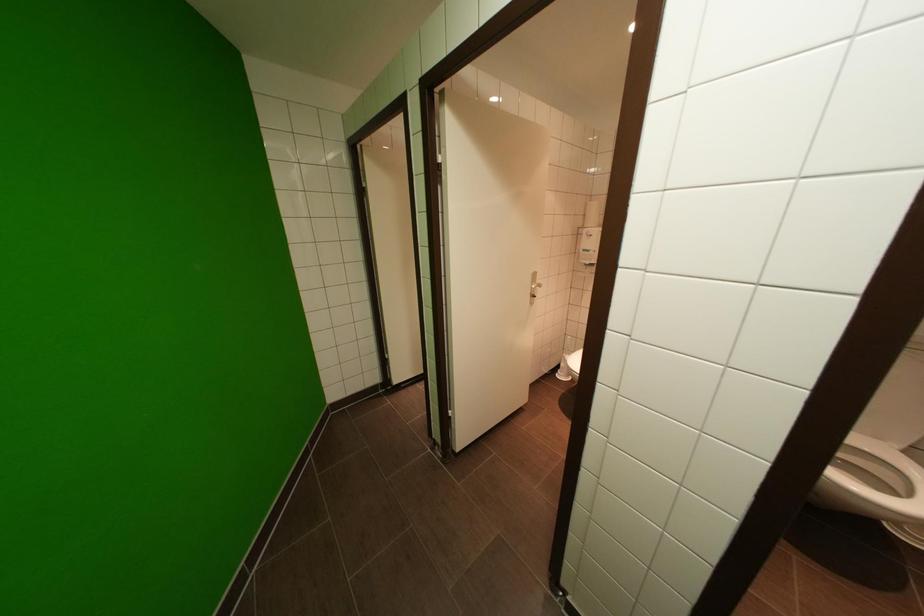
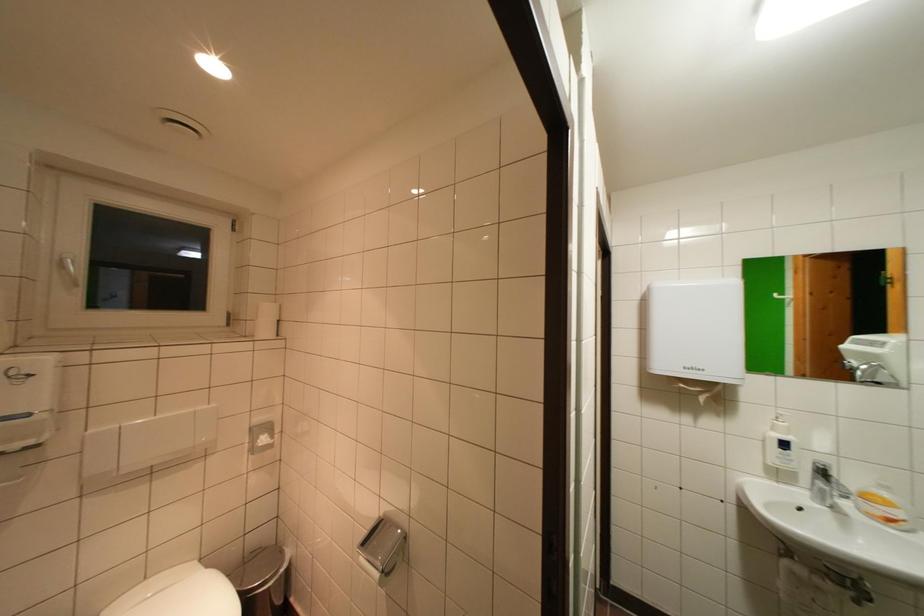
Question: The camera is either moving clockwise (left) or counter-clockwise (right) around the object. The first image is from the beginning of the video and the second image is from the end. Is the camera moving left or right when shooting the video?

Choices:
 (A) Left
 (B) Right

Answer: (A)